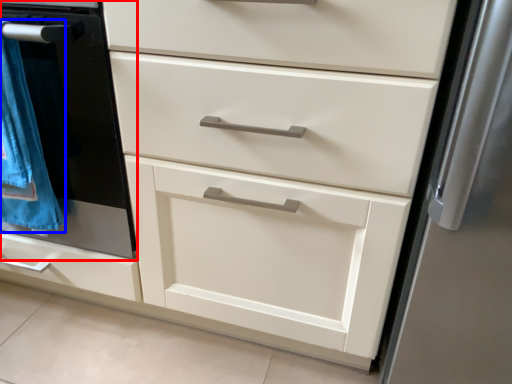
Question: Which object appears closest to the camera in this image, oven (highlighted by a red box) or blanket (highlighted by a blue box)?

Choices:
 (A) oven
 (B) blanket

Answer: (A)